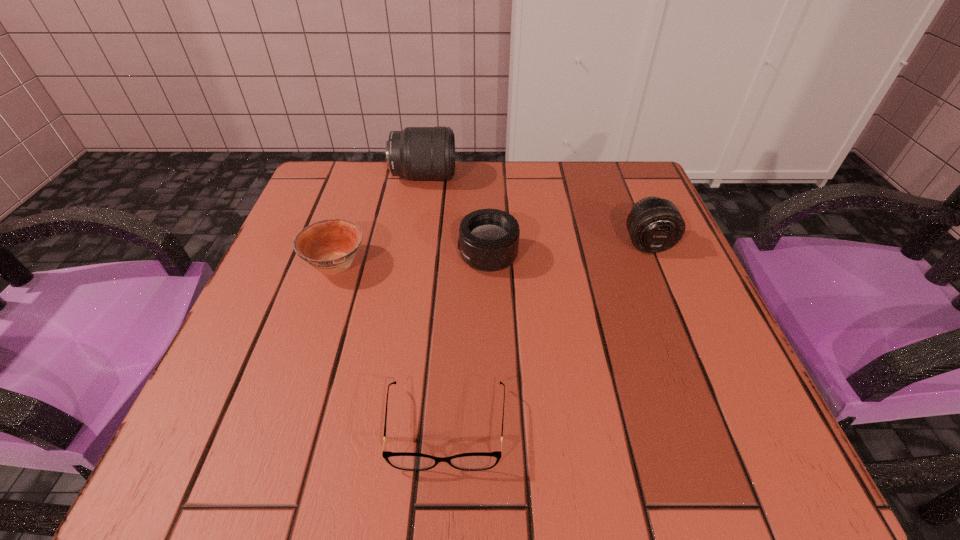
At what (x,y) coordinates should I click in order to perform the action: click on vacant space located on the side of the second telephoto lens from left to right with brand markings and control switches. Please return your answer as a coordinate pair (x, y). This screenshot has width=960, height=540. Looking at the image, I should click on (414, 256).

The image size is (960, 540). I want to click on vacant area situated on the side of the second telephoto lens from left to right with brand markings and control switches, so click(x=334, y=256).

Image resolution: width=960 pixels, height=540 pixels. Find the location of `free region located on the side of the second telephoto lens from left to right with brand markings and control switches`. free region located on the side of the second telephoto lens from left to right with brand markings and control switches is located at coordinates (289, 256).

At what (x,y) coordinates should I click in order to perform the action: click on vacant area located on the right of the bowl. Please return your answer as a coordinate pair (x, y). Image resolution: width=960 pixels, height=540 pixels. Looking at the image, I should click on (464, 265).

In order to click on object present at the far edge in this screenshot , I will do `click(418, 153)`.

Where is `object that is at the near edge`? The width and height of the screenshot is (960, 540). object that is at the near edge is located at coordinates (477, 461).

Identify the location of object that is at the left edge. click(330, 246).

Where is `object that is at the right edge`? object that is at the right edge is located at coordinates (654, 224).

Image resolution: width=960 pixels, height=540 pixels. What are the coordinates of `vacant space at the far edge of the desktop` in the screenshot? It's located at (531, 167).

Locate an element on the screen. vacant space at the near edge is located at coordinates (447, 424).